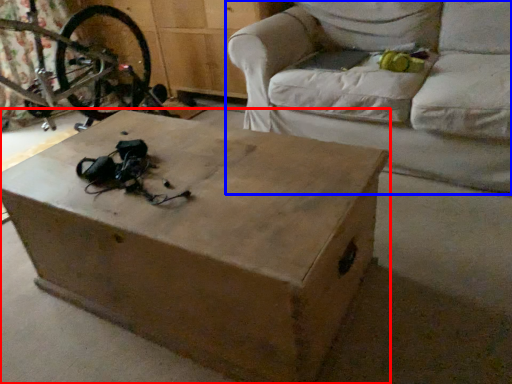
Question: Which object appears closest to the camera in this image, table (highlighted by a red box) or studio couch (highlighted by a blue box)?

Choices:
 (A) table
 (B) studio couch

Answer: (A)